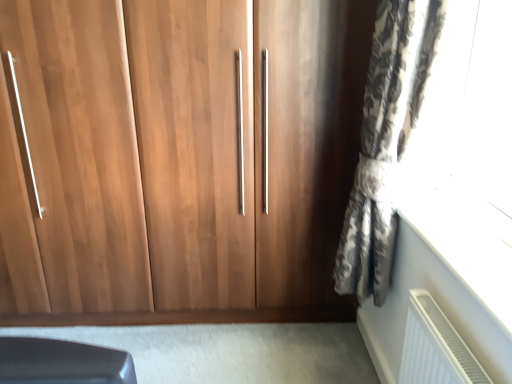
The height and width of the screenshot is (384, 512). Find the location of `patterned fabric curtain at right`. patterned fabric curtain at right is located at coordinates (385, 141).

The height and width of the screenshot is (384, 512). Describe the element at coordinates (385, 141) in the screenshot. I see `patterned fabric curtain at right` at that location.

Where is `patterned fabric curtain at right`? patterned fabric curtain at right is located at coordinates (385, 141).